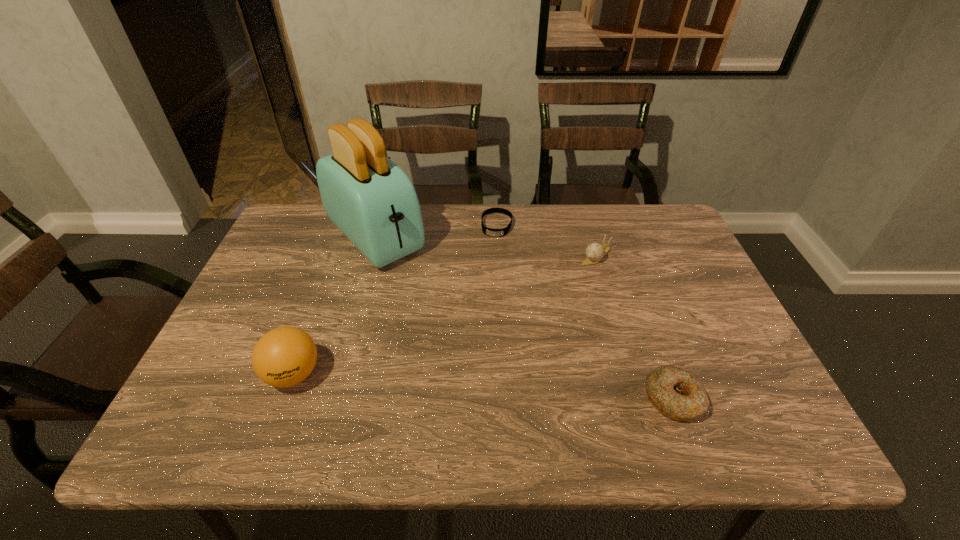
Find the location of `doughnut positioned at the near edge`. doughnut positioned at the near edge is located at coordinates (678, 394).

You are a GUI agent. You are given a task and a screenshot of the screen. Output one action in this format:
    pyautogui.click(x=<x>, y=<y>)
    Task: Click on the ping-pong ball located in the left edge section of the desktop
    The image size is (960, 540).
    Given the screenshot: What is the action you would take?
    pyautogui.click(x=285, y=356)

You are a GUI agent. You are given a task and a screenshot of the screen. Output one action in this format:
    pyautogui.click(x=<x>, y=<y>)
    Task: Click on the toaster present at the left edge
    The image size is (960, 540).
    Given the screenshot: What is the action you would take?
    pyautogui.click(x=372, y=201)

Locate an element on the screen. object at the right edge is located at coordinates (678, 394).

Identify the location of object situated at the far left corner. This screenshot has height=540, width=960. (372, 201).

Identify the location of object located in the near left corner section of the desktop. (285, 356).

At what (x,y) coordinates should I click in order to perform the action: click on object situated at the near right corner. Please return your answer as a coordinate pair (x, y). Looking at the image, I should click on (678, 394).

In the image, there is a desktop. Where is `vacant area at the far edge`? The image size is (960, 540). vacant area at the far edge is located at coordinates (477, 249).

In the image, there is a desktop. Find the location of `free space at the near edge`. free space at the near edge is located at coordinates (593, 402).

The height and width of the screenshot is (540, 960). What are the coordinates of `vacant space at the left edge` in the screenshot? It's located at (312, 259).